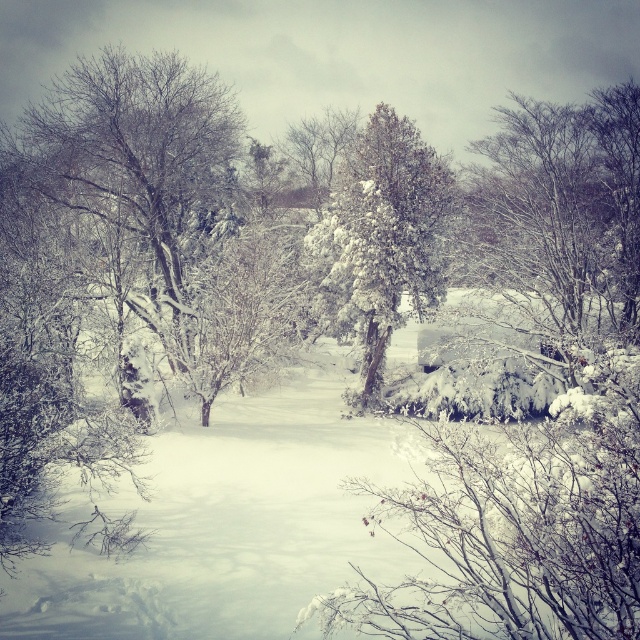
You are standing at the center of the winter landscape and want to locate the point marked as point [564,209]. Based on the scene description, where would this point be located?

The point [564,209] is on the white snow covered tree at upper right.